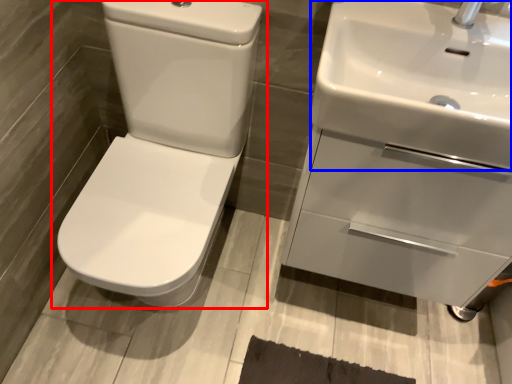
Question: Which object appears farthest to the camera in this image, toilet (highlighted by a red box) or sink (highlighted by a blue box)?

Choices:
 (A) toilet
 (B) sink

Answer: (A)